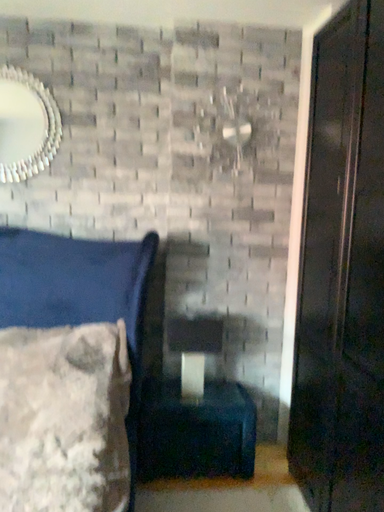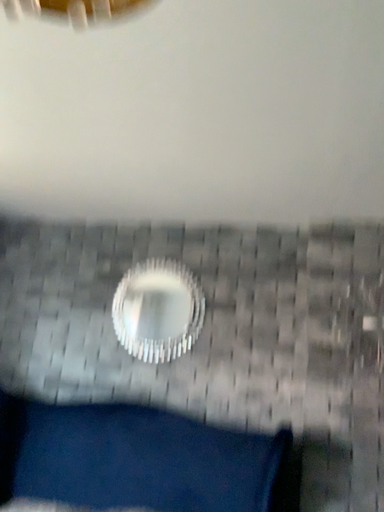
Question: How did the camera likely rotate when shooting the video?

Choices:
 (A) rotated downward
 (B) rotated upward

Answer: (B)